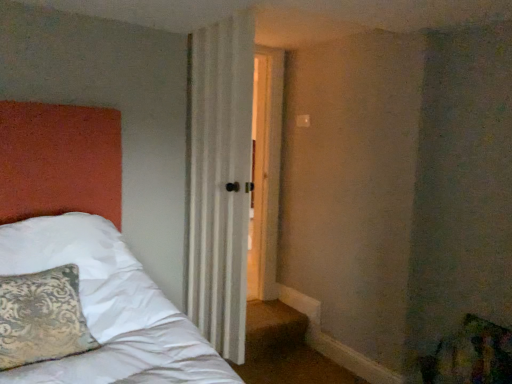
Question: Could you tell me if white sheer curtain at center is turned towards patterned fabric pillow at left?

Choices:
 (A) no
 (B) yes

Answer: (B)

Question: From a real-world perspective, is white sheer curtain at center below patterned fabric pillow at left?

Choices:
 (A) no
 (B) yes

Answer: (A)

Question: Is white sheer curtain at center outside of patterned fabric pillow at left?

Choices:
 (A) no
 (B) yes

Answer: (B)

Question: From the image's perspective, is white sheer curtain at center beneath patterned fabric pillow at left?

Choices:
 (A) yes
 (B) no

Answer: (B)

Question: Is white sheer curtain at center to the left of patterned fabric pillow at left from the viewer's perspective?

Choices:
 (A) no
 (B) yes

Answer: (A)

Question: Does white sheer curtain at center have a lesser width compared to patterned fabric pillow at left?

Choices:
 (A) no
 (B) yes

Answer: (B)

Question: Does patterned fabric pillow at left come behind white sheer curtain at center?

Choices:
 (A) no
 (B) yes

Answer: (A)

Question: Can you confirm if patterned fabric pillow at left is taller than white sheer curtain at center?

Choices:
 (A) yes
 (B) no

Answer: (B)

Question: Is patterned fabric pillow at left facing towards white sheer curtain at center?

Choices:
 (A) no
 (B) yes

Answer: (A)

Question: Can you confirm if patterned fabric pillow at left is bigger than white sheer curtain at center?

Choices:
 (A) yes
 (B) no

Answer: (B)

Question: Is patterned fabric pillow at left positioned with its back to white sheer curtain at center?

Choices:
 (A) no
 (B) yes

Answer: (A)

Question: Does patterned fabric pillow at left have a smaller size compared to white sheer curtain at center?

Choices:
 (A) yes
 (B) no

Answer: (A)

Question: In terms of width, does patterned fabric pillow at left look wider or thinner when compared to white sheer curtain at center?

Choices:
 (A) wide
 (B) thin

Answer: (A)